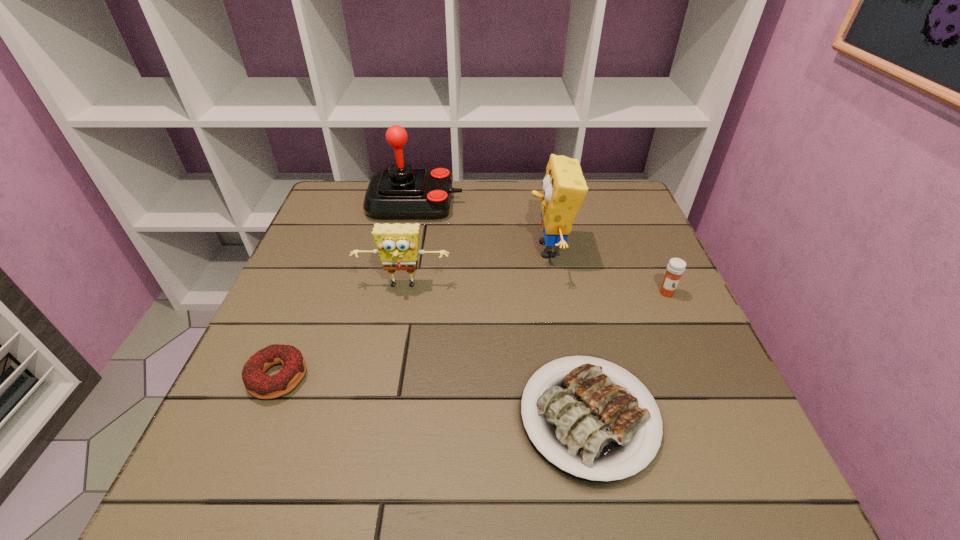
I want to click on vacant space located 0.070m on the face of the taller sponge, so click(x=498, y=249).

Where is `free spot located 0.080m on the face of the taller sponge`? The height and width of the screenshot is (540, 960). free spot located 0.080m on the face of the taller sponge is located at coordinates [494, 249].

Where is `free space located 0.250m on the face of the taller sponge`? The width and height of the screenshot is (960, 540). free space located 0.250m on the face of the taller sponge is located at coordinates (426, 249).

I want to click on free point located 0.060m on the face of the left sponge, so click(397, 316).

This screenshot has height=540, width=960. What are the coordinates of `vacant space situated on the label side of the rightmost object` in the screenshot? It's located at (684, 329).

Where is `vacant area located on the back of the fifth tallest object`? The image size is (960, 540). vacant area located on the back of the fifth tallest object is located at coordinates (330, 248).

You are a GUI agent. You are given a task and a screenshot of the screen. Output one action in this format:
    pyautogui.click(x=<x>, y=<y>)
    Task: Click on the free space located on the right of the plate
    
    Given the screenshot: What is the action you would take?
    pyautogui.click(x=733, y=416)

Where is `joystick located in the far edge section of the desktop`? The height and width of the screenshot is (540, 960). joystick located in the far edge section of the desktop is located at coordinates (402, 192).

I want to click on sponge situated at the far edge, so click(x=564, y=188).

You are a GUI agent. You are given a task and a screenshot of the screen. Output one action in this format:
    pyautogui.click(x=<x>, y=<y>)
    Task: Click on the object that is positioned at the near edge
    The height and width of the screenshot is (540, 960).
    Given the screenshot: What is the action you would take?
    (596, 427)